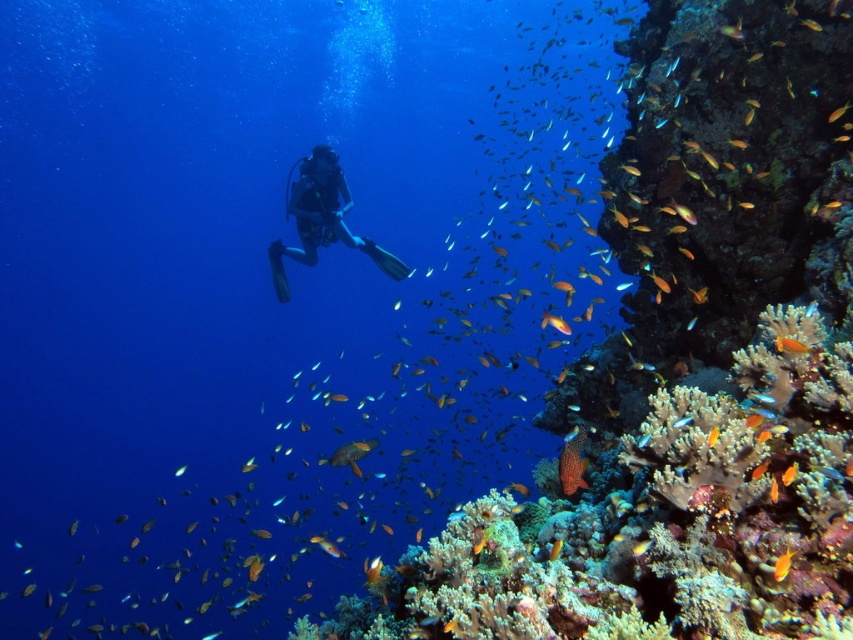
Question: Which of these objects is positioned closest to the rough coral reef at right?

Choices:
 (A) orange coral at lower right
 (B) black scuba diver at center

Answer: (A)

Question: Which is nearer to the orange coral at lower right?

Choices:
 (A) orange matte fish at lower right
 (B) rough coral reef at right

Answer: (B)

Question: Does rough coral reef at right appear over orange coral at lower right?

Choices:
 (A) no
 (B) yes

Answer: (B)

Question: Does rough coral reef at right have a smaller size compared to orange matte fish at lower right?

Choices:
 (A) no
 (B) yes

Answer: (A)

Question: Which of these objects is positioned farthest from the orange matte fish at lower right?

Choices:
 (A) rough coral reef at right
 (B) orange coral at lower right

Answer: (A)

Question: Does rough coral reef at right lie in front of black scuba diver at center?

Choices:
 (A) yes
 (B) no

Answer: (A)